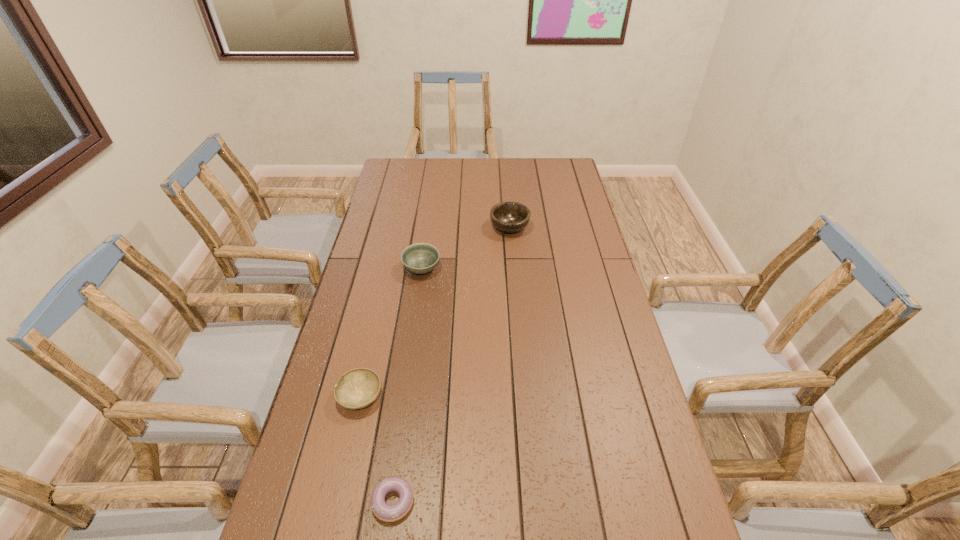
Find the location of a particular element. vacant space that satisfies the following two spatial constraints: 1. on the front side of the doughnut; 2. on the right side of the second farthest object is located at coordinates (388, 501).

Locate an element on the screen. This screenshot has height=540, width=960. vacant space that satisfies the following two spatial constraints: 1. on the back side of the farthest object; 2. on the left side of the doughnut is located at coordinates (430, 228).